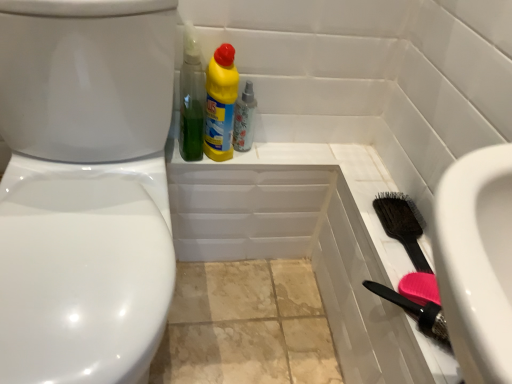
Where is `vacant area located to the right-hand side of yellow plastic bottle at upper center, the 1th cleaning product positioned from the right`? Image resolution: width=512 pixels, height=384 pixels. vacant area located to the right-hand side of yellow plastic bottle at upper center, the 1th cleaning product positioned from the right is located at coordinates (279, 146).